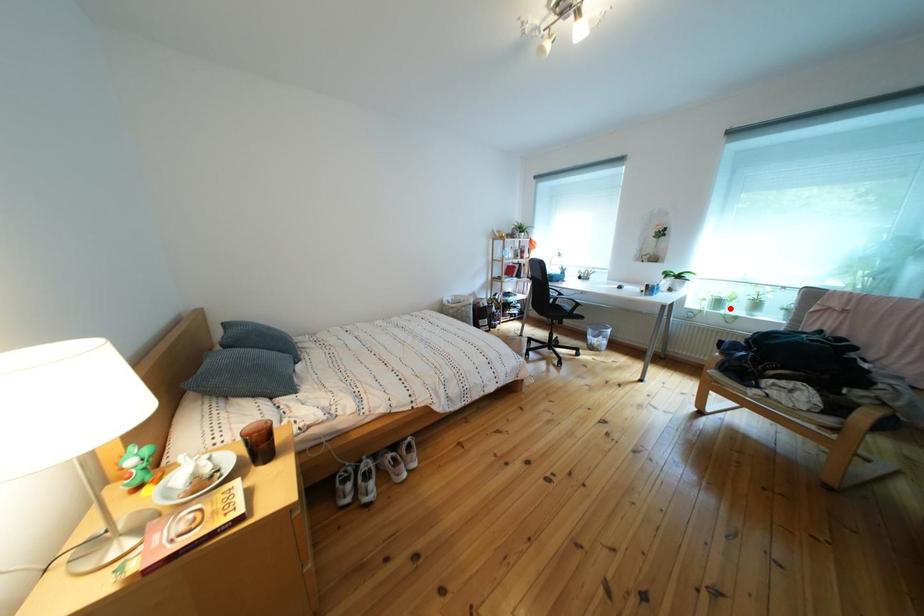
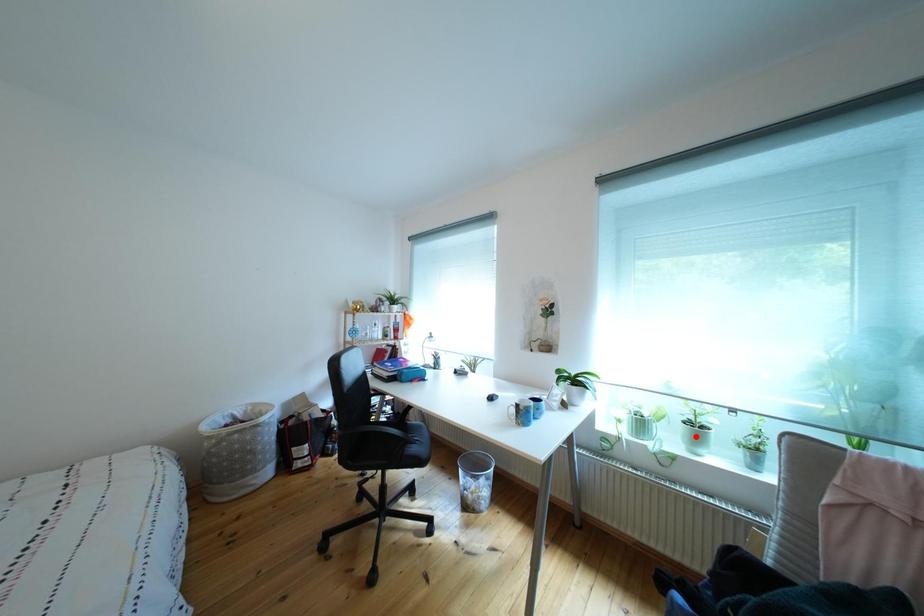
I am providing you with two images of the same scene from different viewpoints. A red point is marked on the first image and another point is marked on the second image. Do the highlighted points in image1 and image2 indicate the same real-world spot?

No